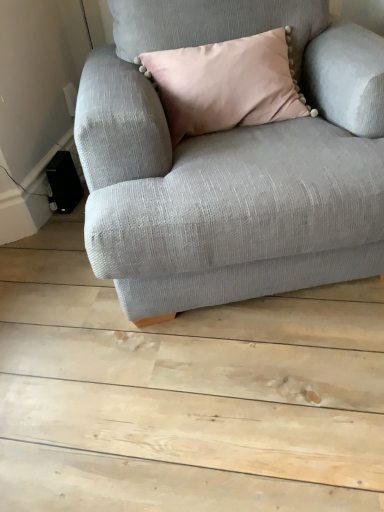
Describe the element at coordinates (232, 164) in the screenshot. I see `textured gray couch at center` at that location.

Find the location of `textured gray couch at center`. textured gray couch at center is located at coordinates (232, 164).

Where is `textured gray couch at center`? The height and width of the screenshot is (512, 384). textured gray couch at center is located at coordinates (232, 164).